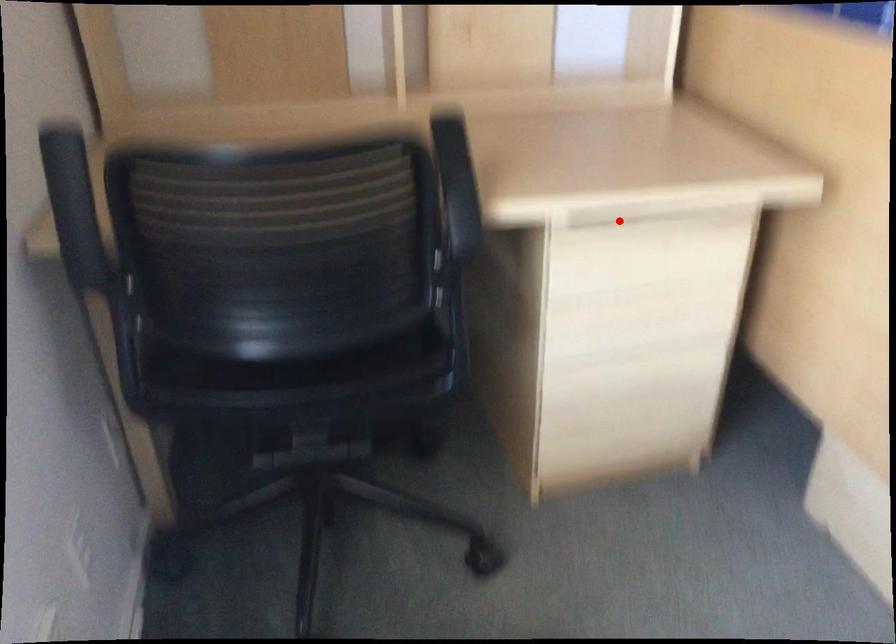
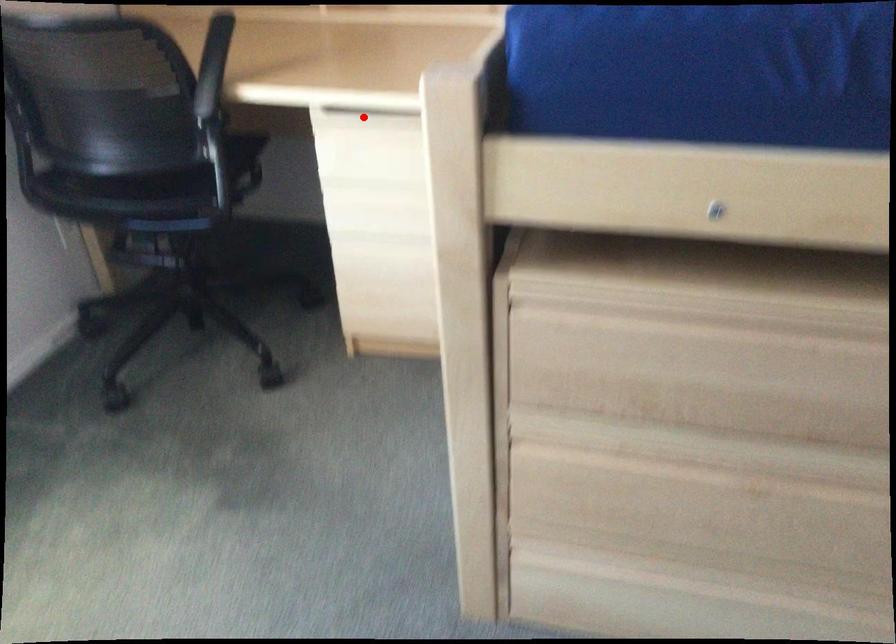
I am providing you with two images of the same scene from different viewpoints. A red point is marked on the first image and another point is marked on the second image. Do the highlighted points in image1 and image2 indicate the same real-world spot?

Yes